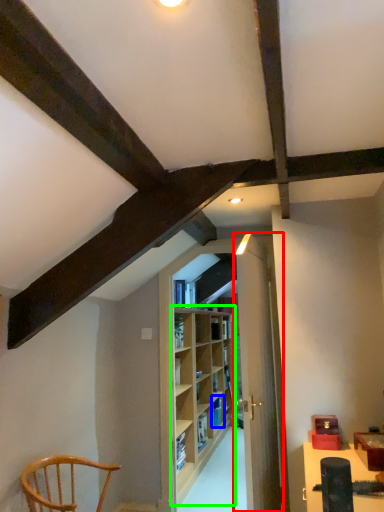
Question: Which is farther away from door (highlighted by a red box)? shelf (highlighted by a blue box) or shelf (highlighted by a green box)?

Choices:
 (A) shelf
 (B) shelf

Answer: (A)